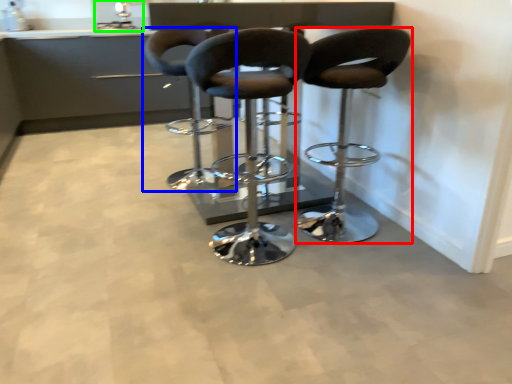
Question: Which is nearer to the chair (highlighted by a red box)? chair (highlighted by a blue box) or sink (highlighted by a green box).

Choices:
 (A) chair
 (B) sink

Answer: (A)